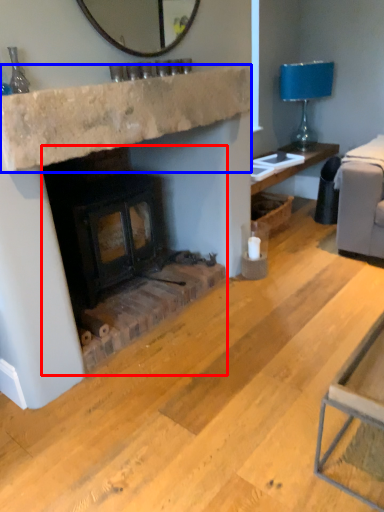
Question: Which object is closer to the camera taking this photo, wood burning stove (highlighted by a red box) or counter top (highlighted by a blue box)?

Choices:
 (A) wood burning stove
 (B) counter top

Answer: (B)